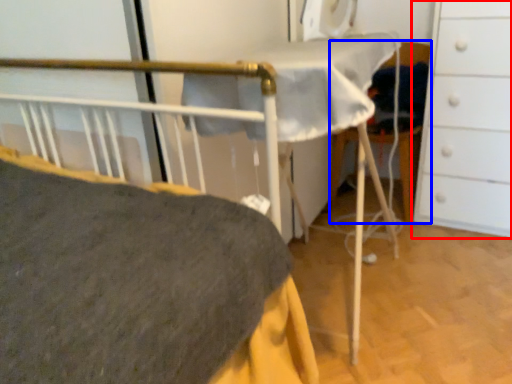
Question: Which object is further to the camera taking this photo, chest of drawers (highlighted by a red box) or folding chair (highlighted by a blue box)?

Choices:
 (A) chest of drawers
 (B) folding chair

Answer: (B)